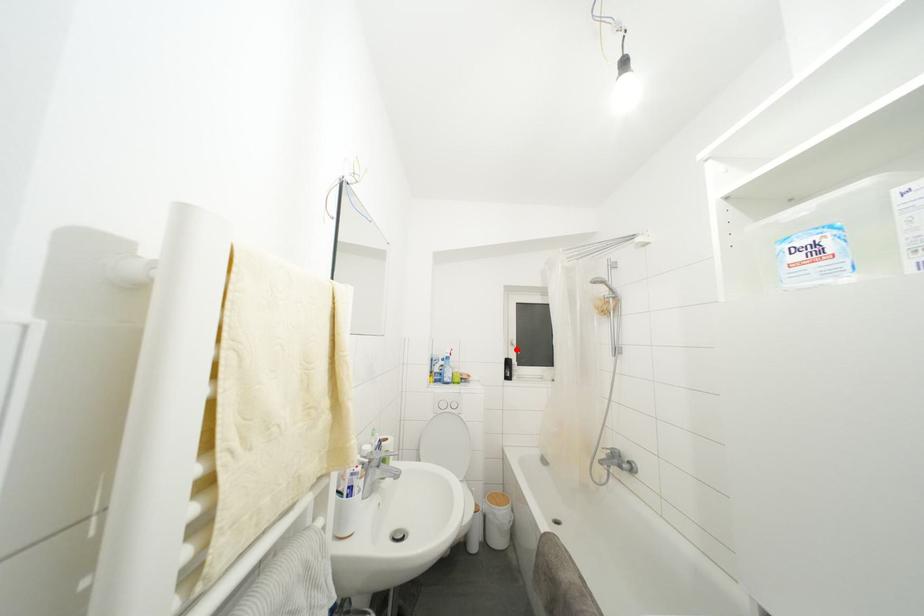
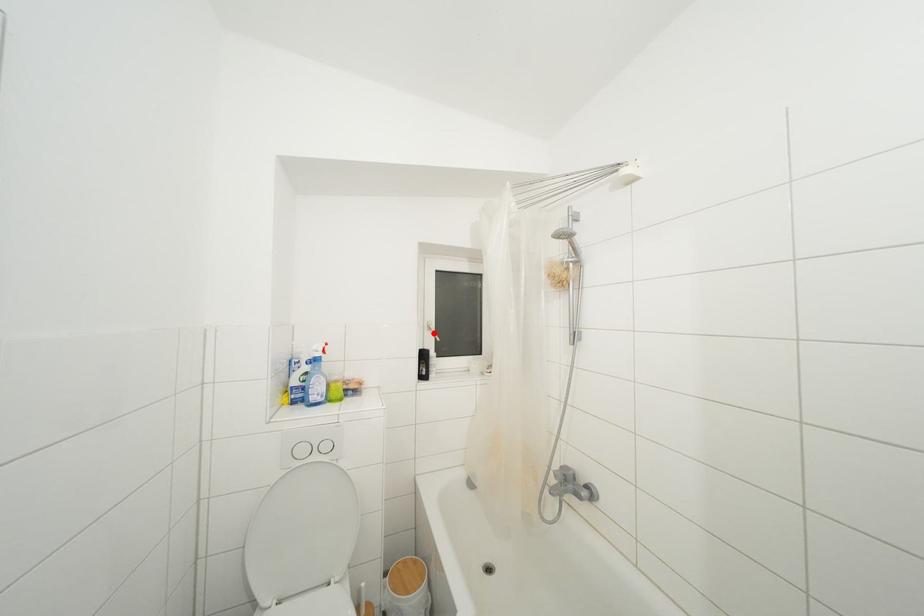
I am providing you with two images of the same scene from different viewpoints. A red point is marked on the first image and another point is marked on the second image. Is the red point in image1 aligned with the point shown in image2?

Yes